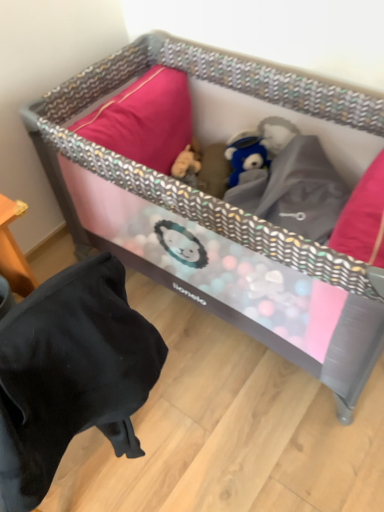
At what (x,y) coordinates should I click in order to perform the action: click on black fabric bean bag chair at lower left. Please return your answer as a coordinate pair (x, y). The width and height of the screenshot is (384, 512). Looking at the image, I should click on (71, 374).

The height and width of the screenshot is (512, 384). What do you see at coordinates (71, 374) in the screenshot? I see `black fabric bean bag chair at lower left` at bounding box center [71, 374].

What do you see at coordinates (187, 165) in the screenshot? The width and height of the screenshot is (384, 512). I see `fuzzy brown stuffed animal at center` at bounding box center [187, 165].

This screenshot has width=384, height=512. What do you see at coordinates (220, 216) in the screenshot?
I see `pink fabric playpen at center` at bounding box center [220, 216].

The height and width of the screenshot is (512, 384). I want to click on black fabric bean bag chair at lower left, so click(x=71, y=374).

Between pink fabric playpen at center and black fabric bean bag chair at lower left, which one appears on the left side from the viewer's perspective?

black fabric bean bag chair at lower left.

Are pink fabric playpen at center and black fabric bean bag chair at lower left far apart?

No, pink fabric playpen at center is not far from black fabric bean bag chair at lower left.

How many degrees apart are the facing directions of pink fabric playpen at center and black fabric bean bag chair at lower left?

The angle between the facing direction of pink fabric playpen at center and the facing direction of black fabric bean bag chair at lower left is 88.4 degrees.

Which of these two, pink fabric playpen at center or black fabric bean bag chair at lower left, stands taller?

With more height is black fabric bean bag chair at lower left.

Does black fabric bean bag chair at lower left have a greater width compared to pink fabric playpen at center?

In fact, black fabric bean bag chair at lower left might be narrower than pink fabric playpen at center.

From a real-world perspective, relative to pink fabric playpen at center, is black fabric bean bag chair at lower left vertically above or below?

From a real-world perspective, black fabric bean bag chair at lower left is physically above pink fabric playpen at center.

Is point (81, 331) behind point (179, 57)?

No.

Which is in front, pink fabric playpen at center or fuzzy brown stuffed animal at center?

pink fabric playpen at center is closer to the camera.

Is pink fabric playpen at center at the left side of fuzzy brown stuffed animal at center?

In fact, pink fabric playpen at center is to the right of fuzzy brown stuffed animal at center.

Based on the photo, what's the angular difference between pink fabric playpen at center and fuzzy brown stuffed animal at center's facing directions?

There is a 4.42-degree angle between the facing directions of pink fabric playpen at center and fuzzy brown stuffed animal at center.

From a real-world perspective, is pink fabric playpen at center positioned under fuzzy brown stuffed animal at center based on gravity?

No, from a real-world perspective, pink fabric playpen at center is not under fuzzy brown stuffed animal at center.

Is fuzzy brown stuffed animal at center facing away from black fabric bean bag chair at lower left?

No, black fabric bean bag chair at lower left is not at the back of fuzzy brown stuffed animal at center.

Is fuzzy brown stuffed animal at center further to the viewer compared to black fabric bean bag chair at lower left?

Yes, it is behind black fabric bean bag chair at lower left.

Is fuzzy brown stuffed animal at center smaller than black fabric bean bag chair at lower left?

Yes.

Is fuzzy brown stuffed animal at center surrounding black fabric bean bag chair at lower left?

No, black fabric bean bag chair at lower left is not surrounded by fuzzy brown stuffed animal at center.

Is point (190, 148) closer or farther from the camera than point (253, 74)?

Point (190, 148) is farther from the camera than point (253, 74).

Based on the photo, is fuzzy brown stuffed animal at center situated inside pink fabric playpen at center or outside?

fuzzy brown stuffed animal at center fits inside pink fabric playpen at center.

Between fuzzy brown stuffed animal at center and pink fabric playpen at center, which one has larger width?

pink fabric playpen at center.

Does fuzzy brown stuffed animal at center have a lesser height compared to pink fabric playpen at center?

Indeed, fuzzy brown stuffed animal at center has a lesser height compared to pink fabric playpen at center.

Who is bigger, black fabric bean bag chair at lower left or fuzzy brown stuffed animal at center?

black fabric bean bag chair at lower left is bigger.

From a real-world perspective, who is located higher, black fabric bean bag chair at lower left or fuzzy brown stuffed animal at center?

black fabric bean bag chair at lower left, from a real-world perspective.

Can you tell me how much black fabric bean bag chair at lower left and fuzzy brown stuffed animal at center differ in facing direction?

The angle between the facing direction of black fabric bean bag chair at lower left and the facing direction of fuzzy brown stuffed animal at center is 92.8 degrees.

I want to click on bean bag chair on the left of pink fabric playpen at center, so click(71, 374).

Find the location of a particular element. The height and width of the screenshot is (512, 384). infant bed on the right of black fabric bean bag chair at lower left is located at coordinates (220, 216).

Looking at the image, which one is located further to black fabric bean bag chair at lower left, pink fabric playpen at center or fuzzy brown stuffed animal at center?

The object further to black fabric bean bag chair at lower left is fuzzy brown stuffed animal at center.

Considering their positions, is black fabric bean bag chair at lower left positioned further to fuzzy brown stuffed animal at center than pink fabric playpen at center?

black fabric bean bag chair at lower left lies further to fuzzy brown stuffed animal at center than the other object.

When comparing their distances from fuzzy brown stuffed animal at center, does pink fabric playpen at center or black fabric bean bag chair at lower left seem closer?

pink fabric playpen at center is positioned closer to the anchor fuzzy brown stuffed animal at center.

Considering their positions, is fuzzy brown stuffed animal at center positioned closer to pink fabric playpen at center than black fabric bean bag chair at lower left?

The object closer to pink fabric playpen at center is fuzzy brown stuffed animal at center.

Which object lies further to the anchor point black fabric bean bag chair at lower left, fuzzy brown stuffed animal at center or pink fabric playpen at center?

fuzzy brown stuffed animal at center is positioned further to the anchor black fabric bean bag chair at lower left.

Consider the image. Considering their positions, is black fabric bean bag chair at lower left positioned further to pink fabric playpen at center than fuzzy brown stuffed animal at center?

black fabric bean bag chair at lower left is positioned further to the anchor pink fabric playpen at center.

Identify the location of infant bed between black fabric bean bag chair at lower left and fuzzy brown stuffed animal at center along the z-axis. (220, 216).